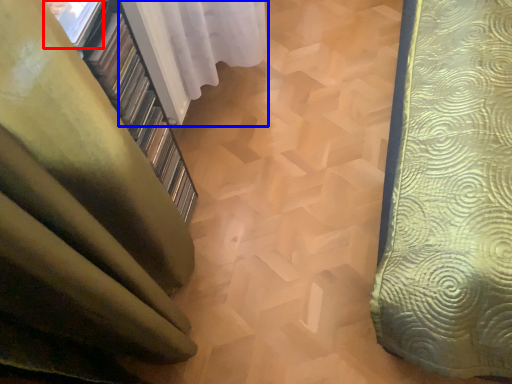
Question: Which point is further to the camera, window (highlighted by a red box) or curtain (highlighted by a blue box)?

Choices:
 (A) window
 (B) curtain

Answer: (B)